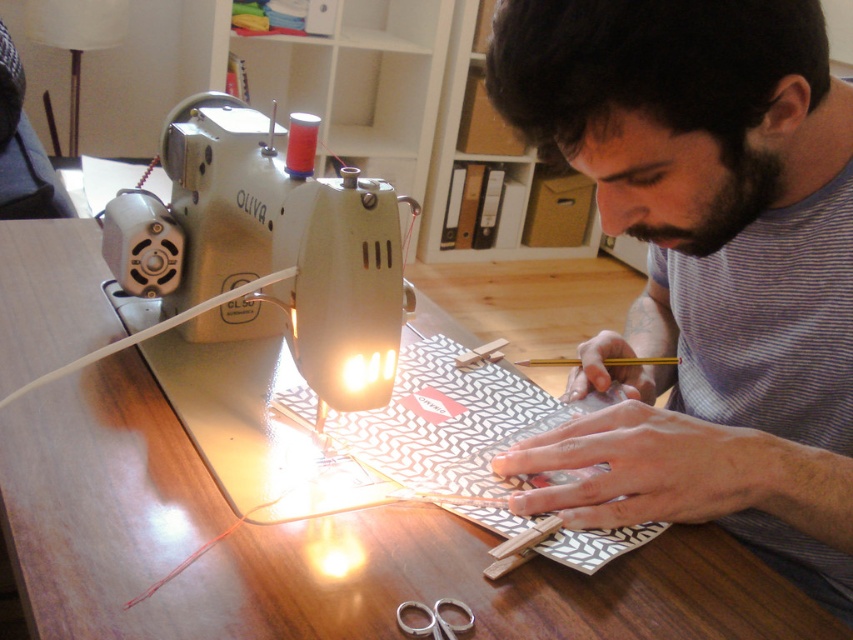
Question: Is wooden table at center above silver metallic scissors at lower center?

Choices:
 (A) no
 (B) yes

Answer: (B)

Question: Does metallic silver sewing machine at center have a larger size compared to silver metallic scissors at lower center?

Choices:
 (A) no
 (B) yes

Answer: (B)

Question: Considering the real-world distances, which object is closest to the silver metallic scissors at lower center?

Choices:
 (A) metallic silver sewing machine at center
 (B) striped cotton shirt at center
 (C) wooden ruler at center

Answer: (B)

Question: Is metallic silver sewing machine at center thinner than wooden ruler at center?

Choices:
 (A) yes
 (B) no

Answer: (B)

Question: Which object is the closest to the striped cotton shirt at center?

Choices:
 (A) metallic silver sewing machine at center
 (B) wooden ruler at center
 (C) silver metallic scissors at lower center

Answer: (A)

Question: Estimate the real-world distances between objects in this image. Which object is closer to the silver metallic scissors at lower center?

Choices:
 (A) striped cotton shirt at center
 (B) wooden ruler at center
 (C) wooden table at center

Answer: (C)